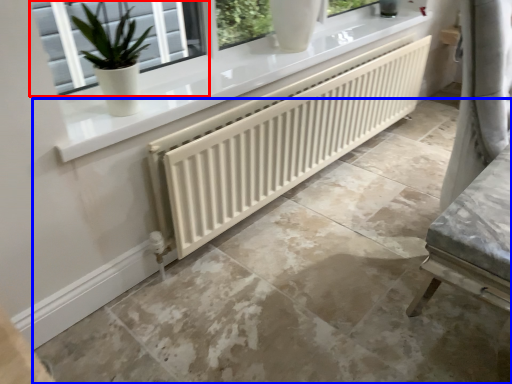
Question: Which object appears farthest to the camera in this image, window (highlighted by a red box) or concrete (highlighted by a blue box)?

Choices:
 (A) window
 (B) concrete

Answer: (A)